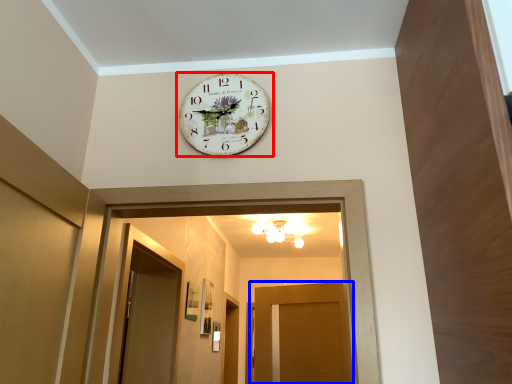
Question: Which of the following is the closest to the observer, wall clock (highlighted by a red box) or door (highlighted by a blue box)?

Choices:
 (A) wall clock
 (B) door

Answer: (A)